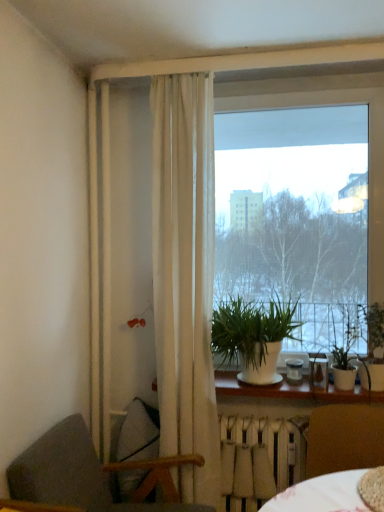
This screenshot has height=512, width=384. In order to click on vacant area on top of green matte plant at right, the second houseplant in the right-to-left sequence (from a real-world perspective) in this screenshot , I will do `click(348, 301)`.